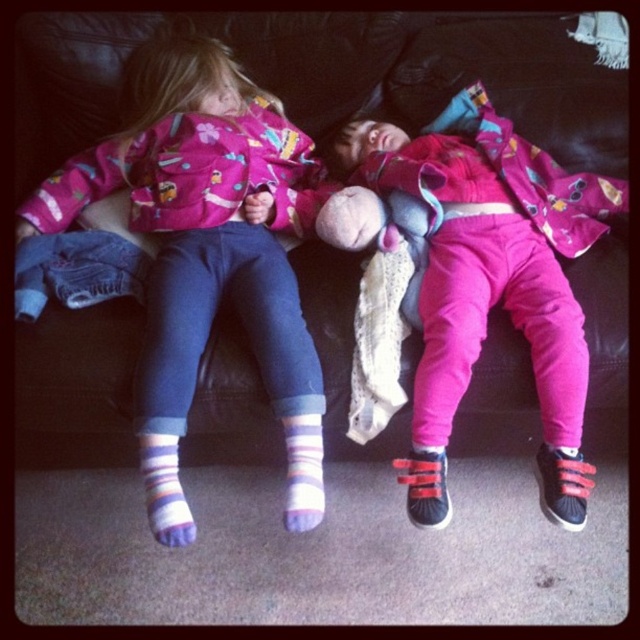
Question: Among these points, which one is farthest from the camera?

Choices:
 (A) (67, 208)
 (B) (573, 333)
 (C) (310, 474)
 (D) (179, 518)

Answer: (A)

Question: Which object is positioned farthest from the black leather couch at center?

Choices:
 (A) pink velour pants at center
 (B) matte pink jacket at upper left
 (C) striped cotton sock at lower center
 (D) striped cotton sock at lower left

Answer: (D)

Question: Which point appears closest to the camera in this image?

Choices:
 (A) (460, 243)
 (B) (276, 161)

Answer: (A)

Question: Is matte pink jacket at upper left thinner than striped cotton sock at lower center?

Choices:
 (A) yes
 (B) no

Answer: (B)

Question: Does black leather couch at center appear over striped cotton sock at lower center?

Choices:
 (A) no
 (B) yes

Answer: (B)

Question: Can you confirm if pink velour pants at center is positioned to the right of striped cotton sock at lower left?

Choices:
 (A) yes
 (B) no

Answer: (A)